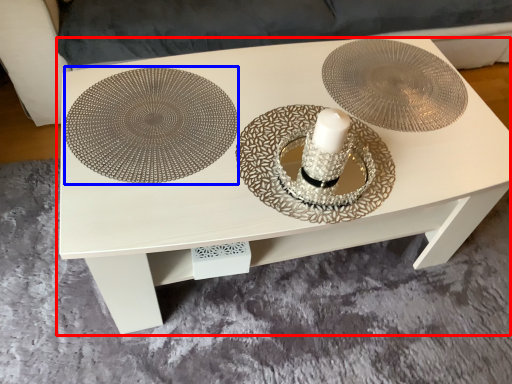
Question: Which of the following is the closest to the observer, table (highlighted by a red box) or place mat (highlighted by a blue box)?

Choices:
 (A) table
 (B) place mat

Answer: (A)